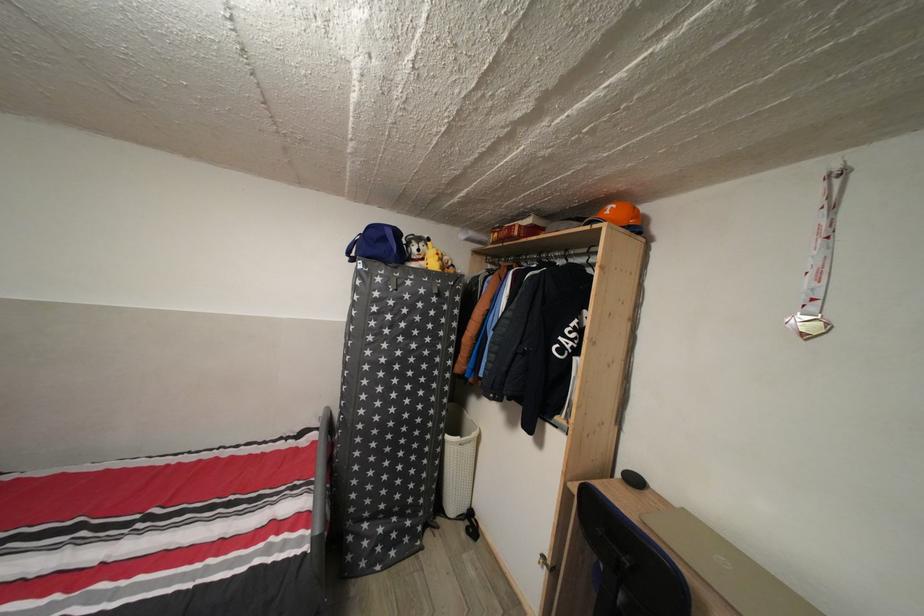
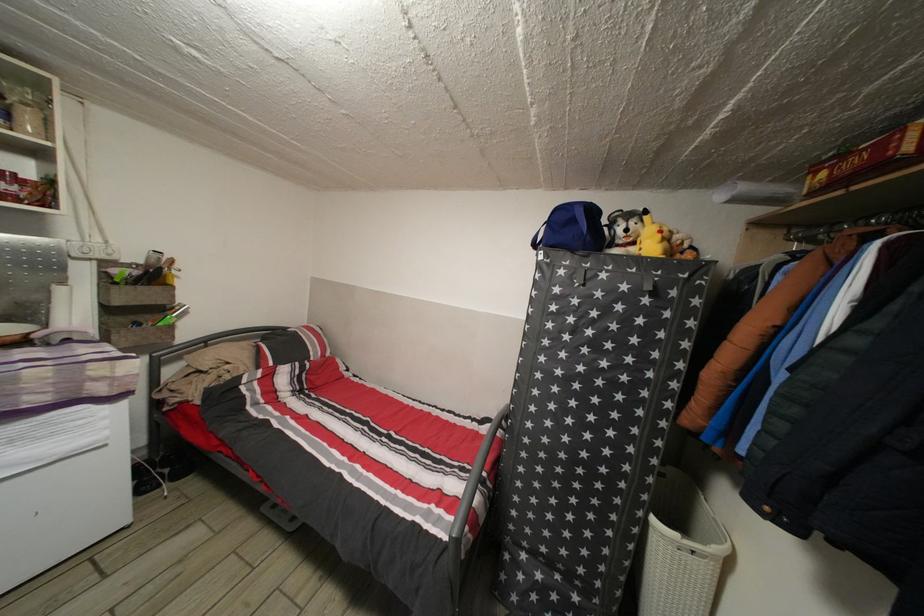
Question: How did the camera likely rotate?

Choices:
 (A) Left
 (B) Right
 (C) Up
 (D) Down

Answer: (A)